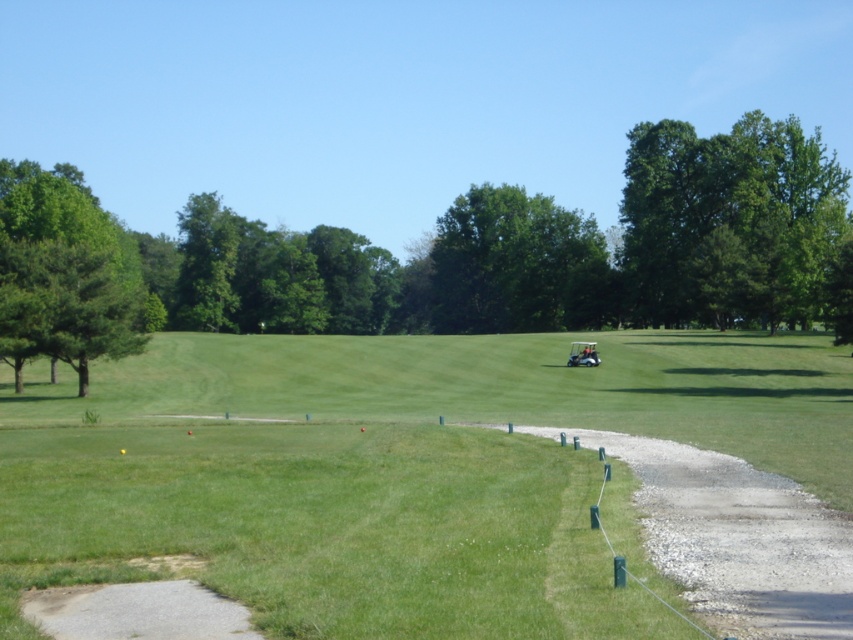
Is green grassy golf course at center to the right of green leafy tree at upper right from the viewer's perspective?

Incorrect, green grassy golf course at center is not on the right side of green leafy tree at upper right.

Who is more forward, (590, 541) or (717, 212)?

Point (590, 541) is more forward.

Does point (676, 337) lie in front of point (782, 170)?

Yes, it is.

This screenshot has height=640, width=853. Find the location of `green grassy golf course at center`. green grassy golf course at center is located at coordinates (399, 467).

Which is above, green grassy golf course at center or green leafy tree at center?

Positioned higher is green leafy tree at center.

At what (x,y) coordinates should I click in order to perform the action: click on green grassy golf course at center. Please return your answer as a coordinate pair (x, y). This screenshot has height=640, width=853. Looking at the image, I should click on 399,467.

Who is more forward, [281,625] or [486,321]?

Positioned in front is point [281,625].

Locate an element on the screen. The width and height of the screenshot is (853, 640). green grassy golf course at center is located at coordinates (399, 467).

Can you confirm if green leafy tree at upper right is thinner than green leafy tree at left?

In fact, green leafy tree at upper right might be wider than green leafy tree at left.

Who is positioned more to the right, green leafy tree at upper right or green leafy tree at left?

From the viewer's perspective, green leafy tree at upper right appears more on the right side.

Does point (746, 298) come closer to viewer compared to point (74, 284)?

No, (746, 298) is behind (74, 284).

Where is `green leafy tree at upper right`? This screenshot has width=853, height=640. green leafy tree at upper right is located at coordinates (730, 221).